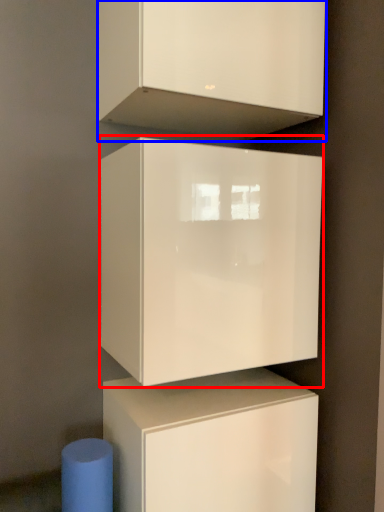
Question: Which point is further to the camera, cabinetry (highlighted by a red box) or cabinetry (highlighted by a blue box)?

Choices:
 (A) cabinetry
 (B) cabinetry

Answer: (A)